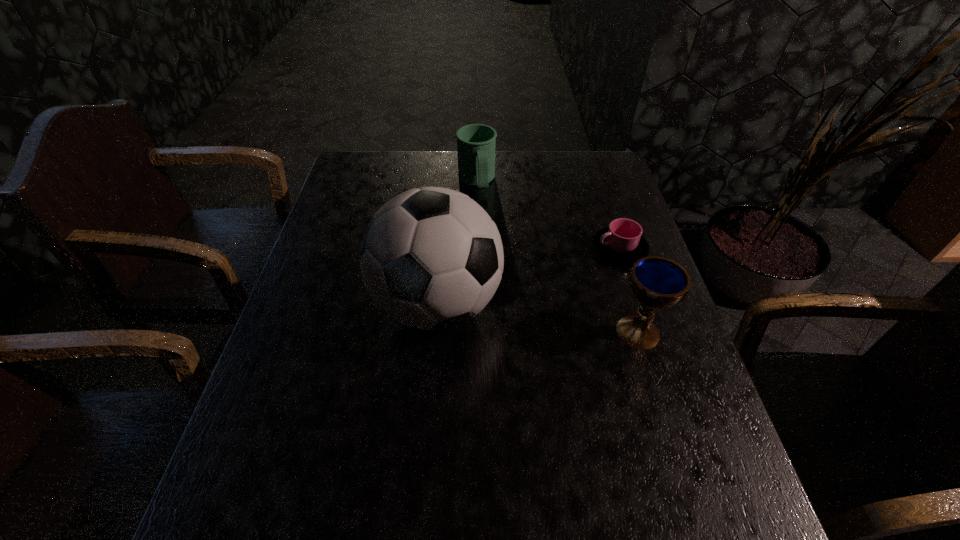
Locate an element on the screen. The image size is (960, 540). blank space located 0.240m on the side with the handle of the shortest object is located at coordinates (534, 300).

The height and width of the screenshot is (540, 960). In order to click on free space located on the side with the handle of the shortest object in this screenshot , I will do (560, 284).

Identify the location of free location located on the side with the handle of the shortest object. The width and height of the screenshot is (960, 540). (501, 319).

The height and width of the screenshot is (540, 960). Identify the location of object that is positioned at the far edge. (476, 143).

The image size is (960, 540). What are the coordinates of `chalice at the right edge` in the screenshot? It's located at (657, 283).

Where is `cup that is at the right edge`? cup that is at the right edge is located at coordinates (622, 242).

Find the location of a particular element. The image size is (960, 540). free point at the far edge is located at coordinates (445, 185).

Image resolution: width=960 pixels, height=540 pixels. I want to click on vacant space at the near edge of the desktop, so click(x=345, y=435).

At what (x,y) coordinates should I click in order to perform the action: click on vacant space at the left edge of the desktop. Please return your answer as a coordinate pair (x, y). This screenshot has height=540, width=960. Looking at the image, I should click on (340, 245).

In the image, there is a desktop. Where is `vacant region at the right edge`? The width and height of the screenshot is (960, 540). vacant region at the right edge is located at coordinates (646, 399).